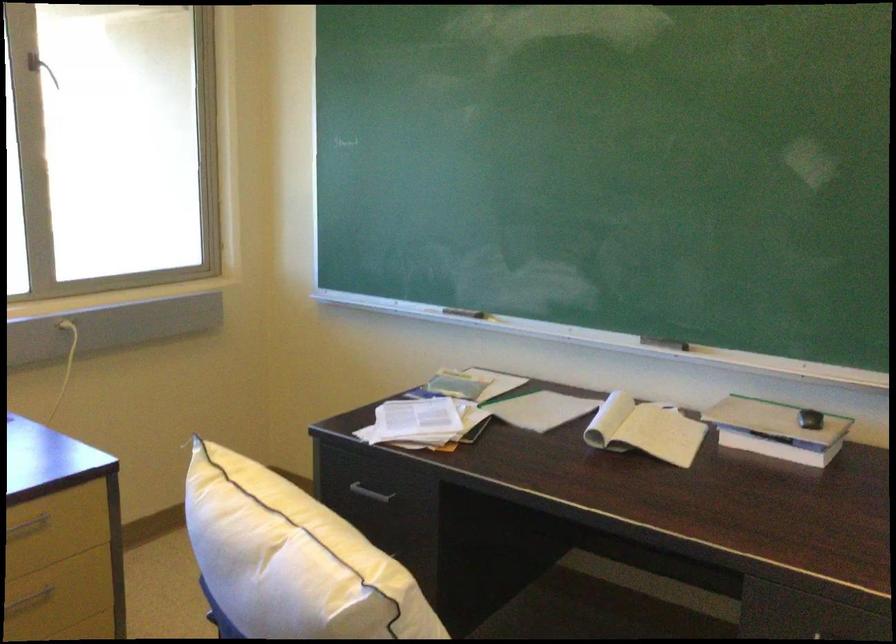
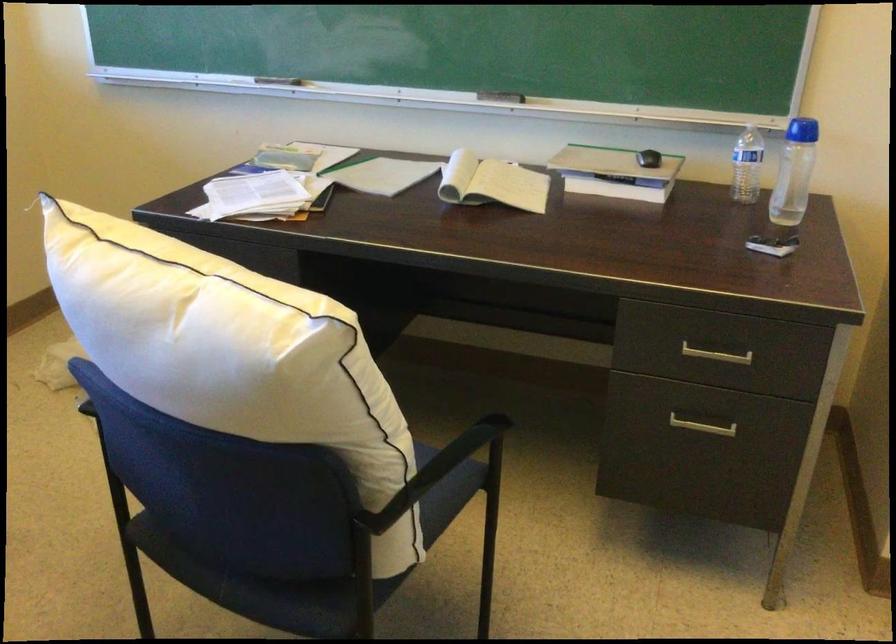
Question: Based on the continuous images, in which direction is the camera rotating? Reply with the corresponding letter.

Choices:
 (A) Left
 (B) Right
 (C) Up
 (D) Down

Answer: (B)